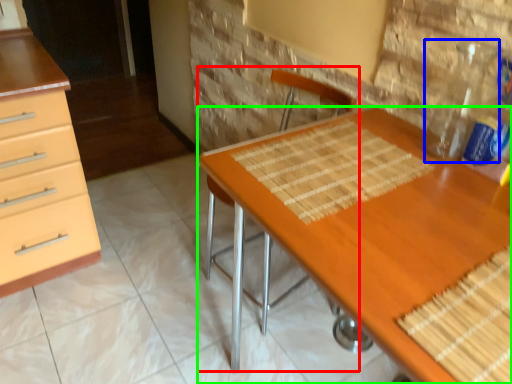
Question: Based on their relative distances, which object is nearer to armchair (highlighted by a red box)? Choose from bottle (highlighted by a blue box) and desk (highlighted by a green box).

Choices:
 (A) bottle
 (B) desk

Answer: (B)